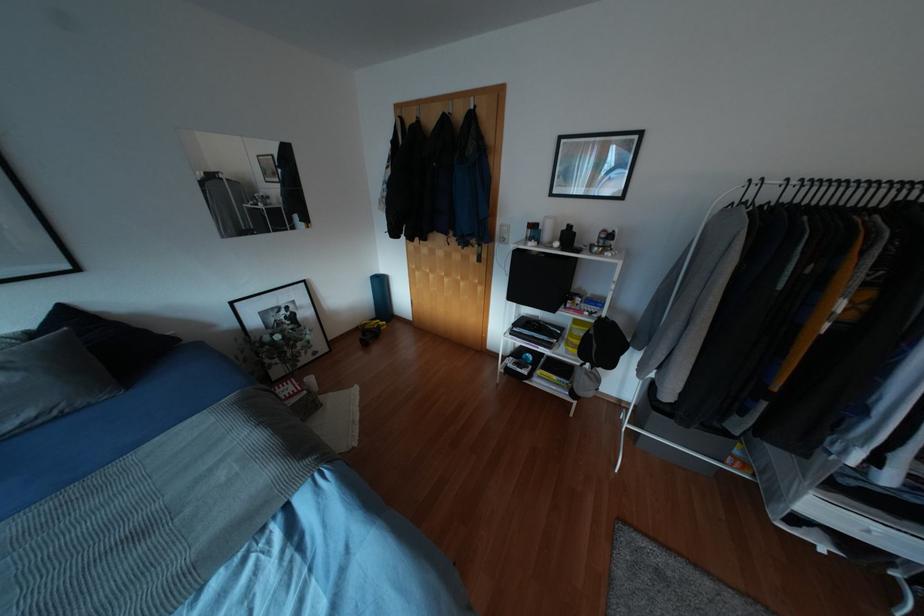
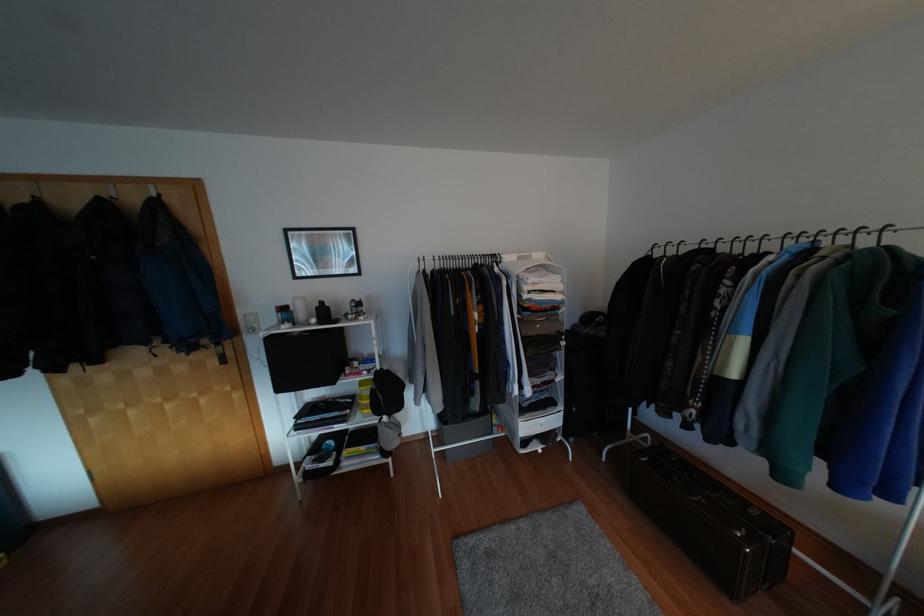
Question: The camera is either moving clockwise (left) or counter-clockwise (right) around the object. The first image is from the beginning of the video and the second image is from the end. Is the camera moving left or right when shooting the video?

Choices:
 (A) Left
 (B) Right

Answer: (A)